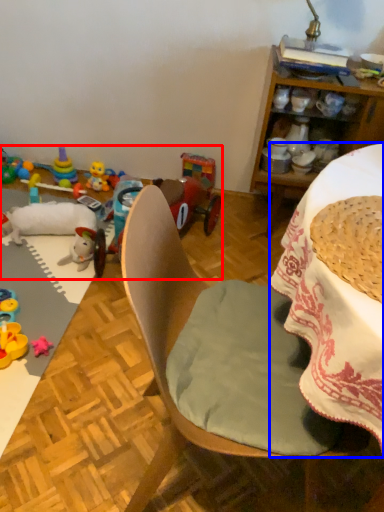
Question: Which object is closer to the camera taking this photo, toy (highlighted by a red box) or desk (highlighted by a blue box)?

Choices:
 (A) toy
 (B) desk

Answer: (B)